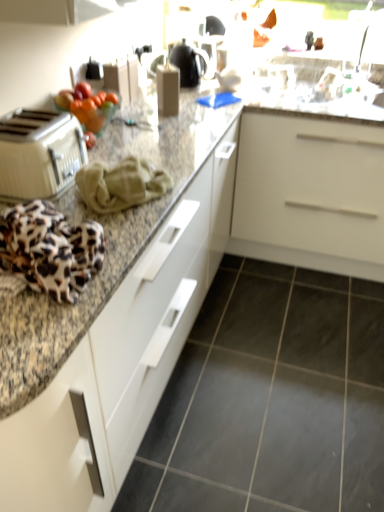
Question: Does point (72, 180) appear closer or farther from the camera than point (122, 276)?

Choices:
 (A) farther
 (B) closer

Answer: (A)

Question: Is beige plastic toaster at left inside the boundaries of granite countertop at center, or outside?

Choices:
 (A) outside
 (B) inside

Answer: (B)

Question: Based on their relative distances, which object is nearer to the metallic silver faucet at upper right?

Choices:
 (A) white matte cabinet at center
 (B) gray tile floor at lower center
 (C) leopard print fabric at left
 (D) granite countertop at center
 (E) shiny glass bowl of fruits at upper left

Answer: (D)

Question: Which is nearer to the leopard print fabric at left?

Choices:
 (A) white matte cabinet at center
 (B) granite countertop at center
 (C) metallic silver faucet at upper right
 (D) gray tile floor at lower center
 (E) shiny glass bowl of fruits at upper left

Answer: (B)